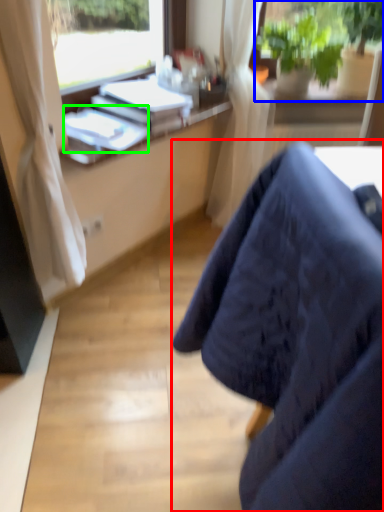
Question: Based on their relative distances, which object is nearer to chair (highlighted by a red box)? Choose from houseplant (highlighted by a blue box) and book (highlighted by a green box).

Choices:
 (A) houseplant
 (B) book

Answer: (B)